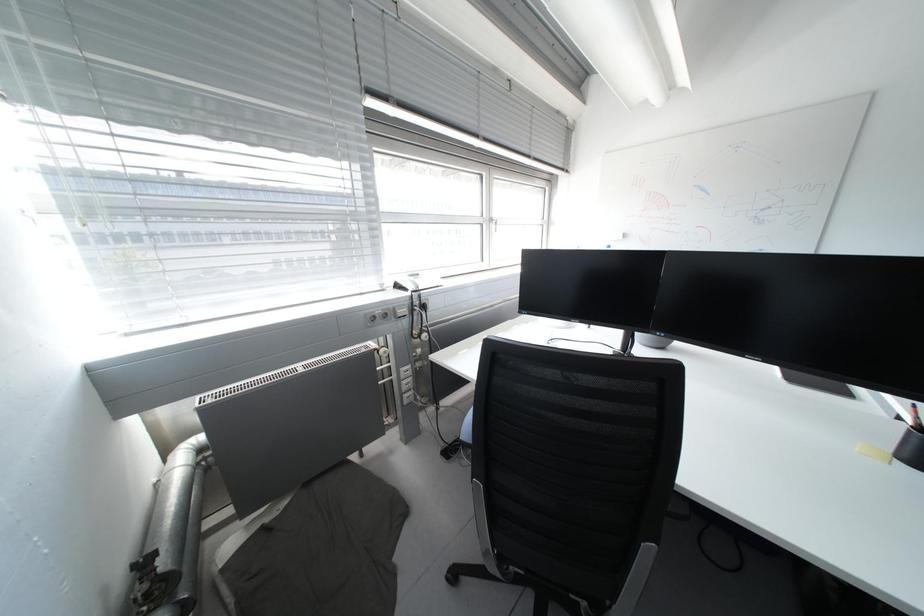
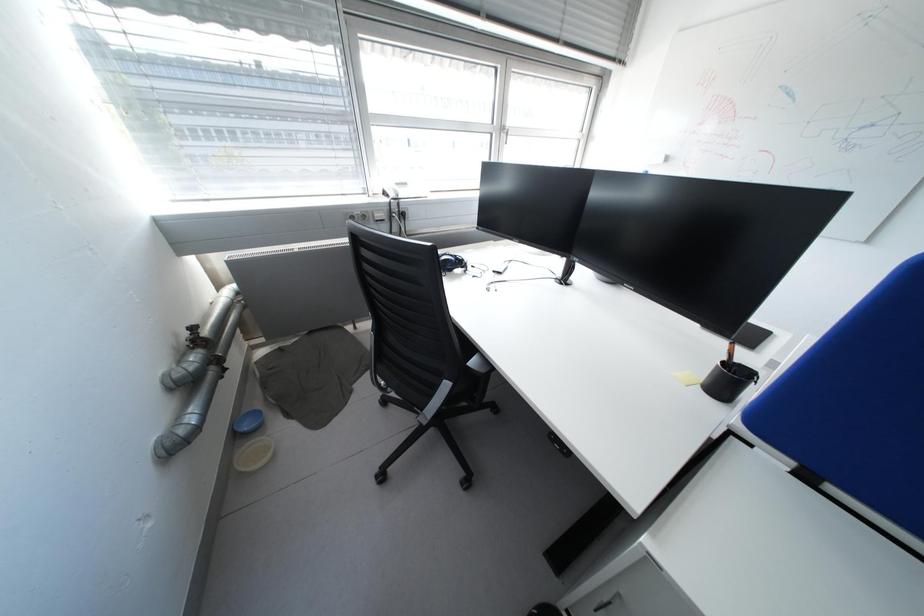
Question: Which direction would the cameraman need to move to produce the second image? Reply with the corresponding letter.

Choices:
 (A) Left
 (B) Right
 (C) Forward
 (D) Backward

Answer: (B)